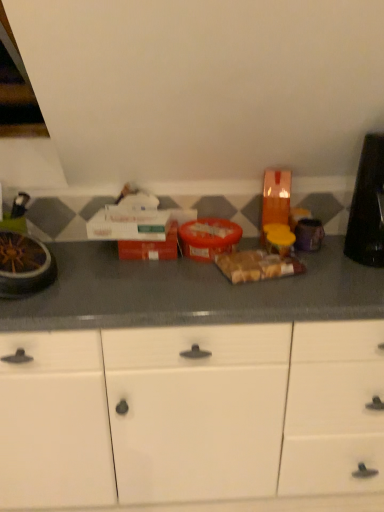
Identify the location of free space between black plastic toaster at right, which ranks as the 2th appliance in left-to-right order, and translucent plastic bag of bread at center. Image resolution: width=384 pixels, height=512 pixels. (319, 263).